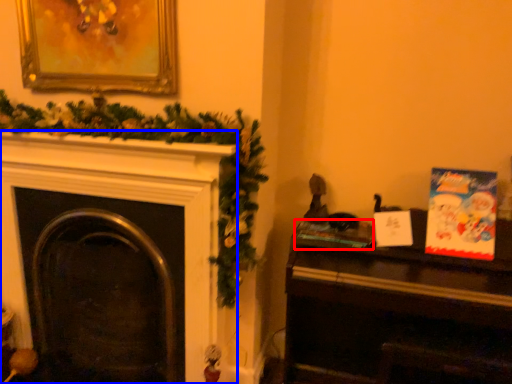
Question: Which point is further to the camera, book (highlighted by a red box) or fireplace (highlighted by a blue box)?

Choices:
 (A) book
 (B) fireplace

Answer: (A)